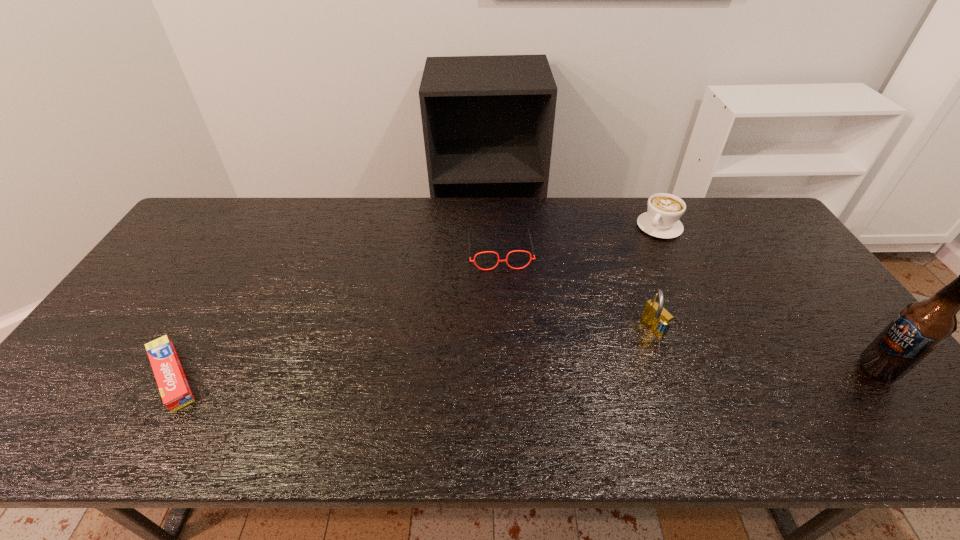
Locate an element on the screen. vacant region that satisfies the following two spatial constraints: 1. on the back side of the beer bottle; 2. on the label of the leftmost object is located at coordinates (177, 369).